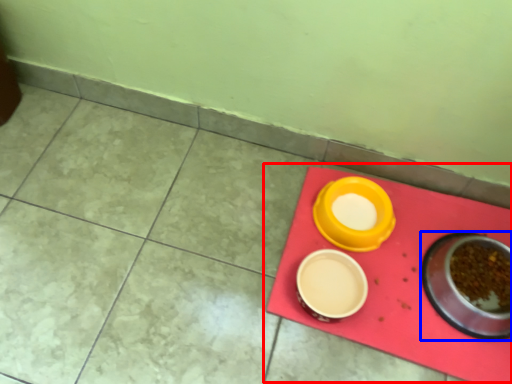
Question: Among these objects, which one is farthest to the camera, table (highlighted by a red box) or tableware (highlighted by a blue box)?

Choices:
 (A) table
 (B) tableware

Answer: (A)